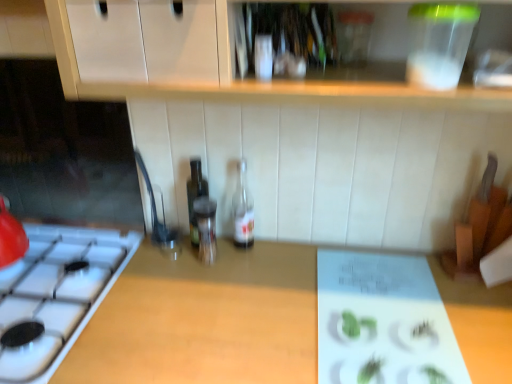
At what (x,y) coordinates should I click in order to perform the action: click on free space in front of translucent glass bottle at center, the third bottle in the right-to-left sequence. Please return your answer as a coordinate pair (x, y). Looking at the image, I should click on (194, 280).